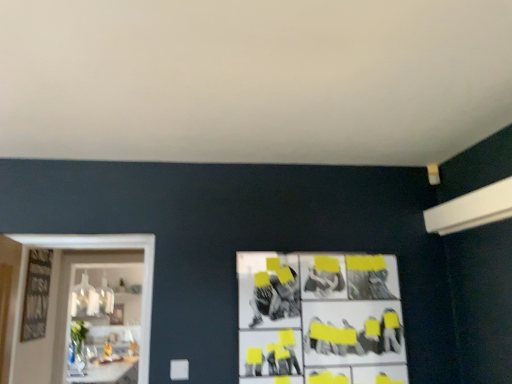
The width and height of the screenshot is (512, 384). What do you see at coordinates (112, 324) in the screenshot?
I see `white glossy shelf at left` at bounding box center [112, 324].

Identify the location of white glossy shelf at left. The height and width of the screenshot is (384, 512). (112, 324).

The width and height of the screenshot is (512, 384). I want to click on shelf in front of the white glossy table at lower left, so click(112, 324).

Does point (116, 373) come farther from viewer compared to point (127, 316)?

That is False.

Can we say black and white collage at center lies outside white glossy shelf at left?

black and white collage at center is positioned outside white glossy shelf at left.

I want to click on shelf located underneath the black and white collage at center (from a real-world perspective), so (x=112, y=324).

Considering the relative sizes of black and white collage at center and white glossy shelf at left in the image provided, is black and white collage at center thinner than white glossy shelf at left?

Correct, the width of black and white collage at center is less than that of white glossy shelf at left.

Based on the photo, is black and white collage at center at the back of white glossy shelf at left?

No, white glossy shelf at left's orientation is not away from black and white collage at center.

From the picture: Are white glossy shelf at left and black and white collage at center beside each other?

No, white glossy shelf at left is not beside black and white collage at center.

Considering the points (84, 268) and (324, 304), which point is in front, point (84, 268) or point (324, 304)?

The point (324, 304) is closer to the camera.

At what (x,y) coordinates should I click in order to perform the action: click on shelf beneath the black and white collage at center (from a real-world perspective). Please return your answer as a coordinate pair (x, y). The width and height of the screenshot is (512, 384). Looking at the image, I should click on (112, 324).

Is black and white collage at center far from white glossy table at lower left?

black and white collage at center is positioned a significant distance from white glossy table at lower left.

Which is more to the right, black and white collage at center or white glossy table at lower left?

black and white collage at center.

Identify the location of table below the black and white collage at center (from the image's perspective). (109, 372).

How distant is black and white collage at center from white glossy table at lower left?

They are 5.86 feet apart.

Is white glossy table at lower left closer to camera compared to black and white collage at center?

No, white glossy table at lower left is further to the viewer.

Who is bigger, white glossy table at lower left or black and white collage at center?

Bigger between the two is white glossy table at lower left.

In the scene shown: How many degrees apart are the facing directions of white glossy table at lower left and black and white collage at center?

The angular difference between white glossy table at lower left and black and white collage at center is 89.8 degrees.

Locate an element on the screen. This screenshot has height=384, width=512. poster lying above the white glossy table at lower left (from the image's perspective) is located at coordinates (320, 318).

Does point (121, 370) come closer to viewer compared to point (121, 383)?

That is False.

Which is more to the right, white glossy shelf at left or white glossy table at lower left?

white glossy shelf at left is more to the right.

Is white glossy shelf at left shorter than white glossy table at lower left?

No, white glossy shelf at left is not shorter than white glossy table at lower left.

Is white glossy shelf at left aimed at white glossy table at lower left?

No, white glossy shelf at left is not oriented towards white glossy table at lower left.

Where is `shelf above the white glossy table at lower left (from a real-world perspective)`? This screenshot has width=512, height=384. shelf above the white glossy table at lower left (from a real-world perspective) is located at coordinates (112, 324).

The height and width of the screenshot is (384, 512). What are the coordinates of `poster on the right of white glossy shelf at left` in the screenshot? It's located at (320, 318).

Looking at the image, which one is located closer to white glossy table at lower left, white glossy shelf at left or black and white collage at center?

The object closer to white glossy table at lower left is white glossy shelf at left.

Estimate the real-world distances between objects in this image. Which object is further from white glossy shelf at left, white glossy table at lower left or black and white collage at center?

black and white collage at center is positioned further to the anchor white glossy shelf at left.

Looking at the image, which one is located closer to white glossy table at lower left, black and white collage at center or white glossy shelf at left?

white glossy shelf at left lies closer to white glossy table at lower left than the other object.

Considering their positions, is white glossy shelf at left positioned further to black and white collage at center than white glossy table at lower left?

white glossy shelf at left is further to black and white collage at center.

From the image, which object appears to be farther from white glossy shelf at left, black and white collage at center or white glossy table at lower left?

Based on the image, black and white collage at center appears to be further to white glossy shelf at left.

From the image, which object appears to be farther from black and white collage at center, white glossy table at lower left or white glossy shelf at left?

white glossy shelf at left lies further to black and white collage at center than the other object.

Locate an element on the screen. This screenshot has width=512, height=384. shelf situated between white glossy table at lower left and black and white collage at center from left to right is located at coordinates (112, 324).